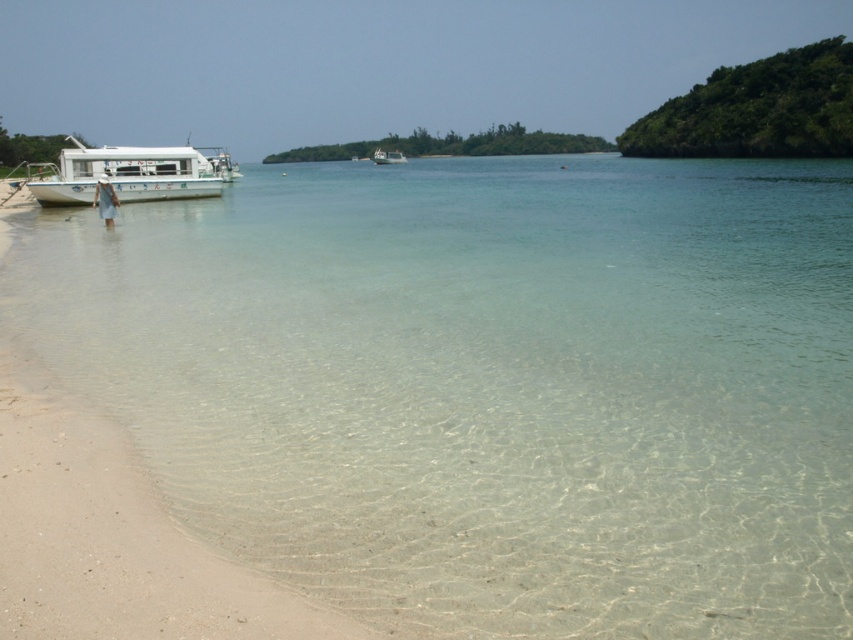
You are standing on the beach and want to take a photo of the white matte boat at left. If your camera has a maximum zoom range of 25 meters, will you be able to capture the boat clearly?

The white matte boat at left is 27.00 meters away from the camera. Since the camera can only zoom up to 25 meters, you won not be able to capture the boat clearly.

You are planning to take a boat ride and see two boats available. The white matte boat at left and the white glossy boat at center. Which boat is closer to the shore?

The white matte boat at left is closer to the shore because it is positioned below the white glossy boat at center, indicating it is nearer to the observer.